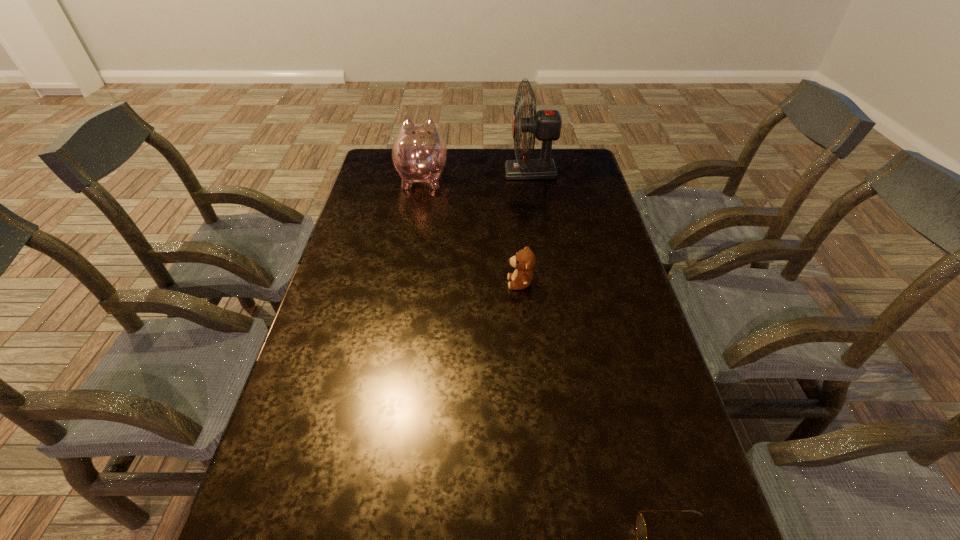
Locate an element on the screen. free space located 0.240m on the face of the teddy bear is located at coordinates (423, 283).

What are the coordinates of `free space located 0.150m on the face of the teddy bear` in the screenshot? It's located at (455, 283).

This screenshot has width=960, height=540. Find the location of `fan present at the far edge`. fan present at the far edge is located at coordinates (545, 125).

Locate an element on the screen. piggy bank that is positioned at the far edge is located at coordinates (419, 154).

In order to click on object that is at the left edge in this screenshot , I will do click(419, 154).

Where is `object that is at the right edge`? The image size is (960, 540). object that is at the right edge is located at coordinates (545, 125).

The width and height of the screenshot is (960, 540). In order to click on object at the far left corner in this screenshot , I will do `click(419, 154)`.

The image size is (960, 540). Find the location of `object situated at the far right corner`. object situated at the far right corner is located at coordinates (545, 125).

Image resolution: width=960 pixels, height=540 pixels. Identify the location of vacant point at the left edge. (347, 370).

The width and height of the screenshot is (960, 540). In the image, there is a desktop. Find the location of `free space at the right edge`. free space at the right edge is located at coordinates (580, 265).